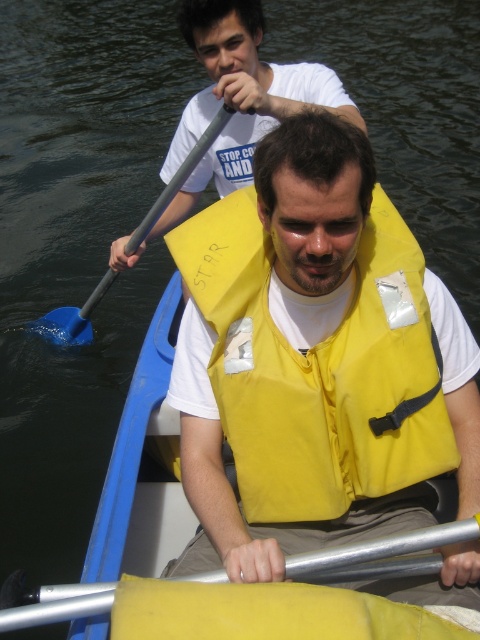
Question: In this image, where is yellow life vest at center located relative to yellow rubber paddle at center?

Choices:
 (A) right
 (B) left

Answer: (B)

Question: Which of the following is the closest to the observer?

Choices:
 (A) (146, 240)
 (B) (51, 326)

Answer: (A)

Question: Is yellow fabric life vest at center in front of yellow rubber paddle at center?

Choices:
 (A) no
 (B) yes

Answer: (A)

Question: Among these objects, which one is nearest to the camera?

Choices:
 (A) yellow rubber paddle at center
 (B) yellow fabric life vest at center

Answer: (A)

Question: Is yellow rubber paddle at center in front of blue rubber paddle at left?

Choices:
 (A) yes
 (B) no

Answer: (A)

Question: Which object is farther from the camera taking this photo?

Choices:
 (A) yellow rubber paddle at center
 (B) blue rubber paddle at left
 (C) yellow fabric life vest at center
 (D) yellow life vest at center

Answer: (B)